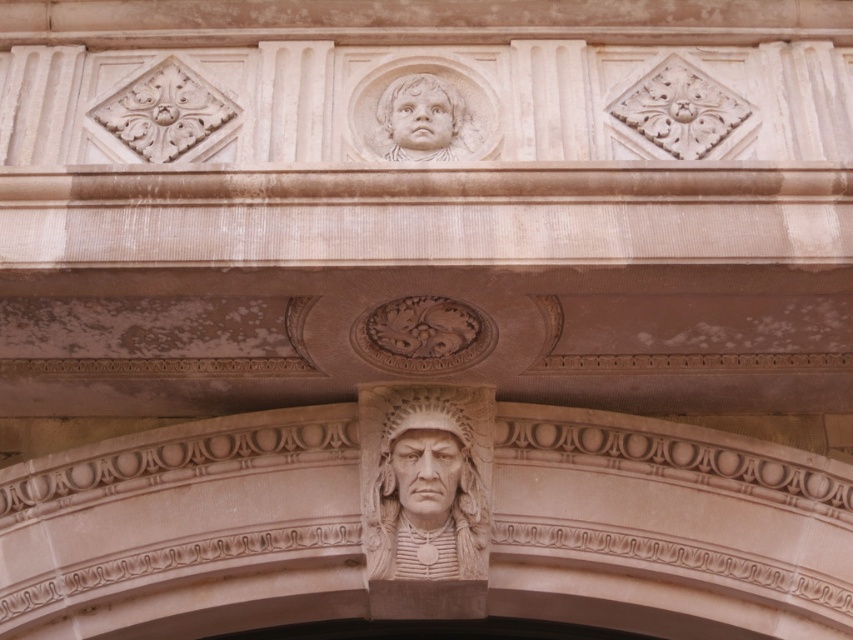
The image size is (853, 640). Identify the location of matte stone face at center. (426, 470).

Can you confirm if matte stone face at center is positioned above smooth stone face at upper center?

Incorrect, matte stone face at center is not positioned above smooth stone face at upper center.

This screenshot has width=853, height=640. Find the location of `matte stone face at center`. matte stone face at center is located at coordinates (426, 470).

Is carved stone indian head at center to the left of smooth stone face at upper center from the viewer's perspective?

Yes, carved stone indian head at center is to the left of smooth stone face at upper center.

Which of these two, carved stone indian head at center or smooth stone face at upper center, stands taller?

Standing taller between the two is carved stone indian head at center.

Between point (483, 413) and point (403, 90), which one is positioned in front?

Point (403, 90) is in front.

Locate an element on the screen. The height and width of the screenshot is (640, 853). carved stone indian head at center is located at coordinates (451, 472).

Does smooth beige stone head at upper center have a smaller size compared to smooth stone face at upper center?

No, smooth beige stone head at upper center is not smaller than smooth stone face at upper center.

Between smooth beige stone head at upper center and smooth stone face at upper center, which one is positioned lower?

Positioned lower is smooth stone face at upper center.

Locate an element on the screen. Image resolution: width=853 pixels, height=640 pixels. smooth beige stone head at upper center is located at coordinates (421, 116).